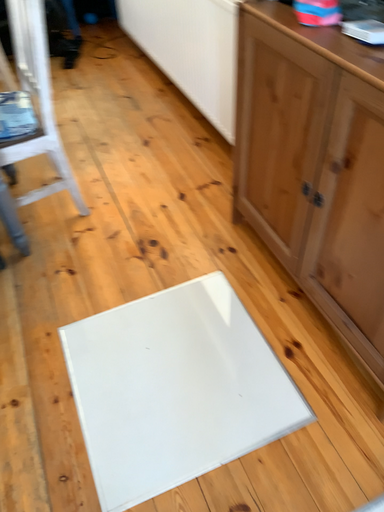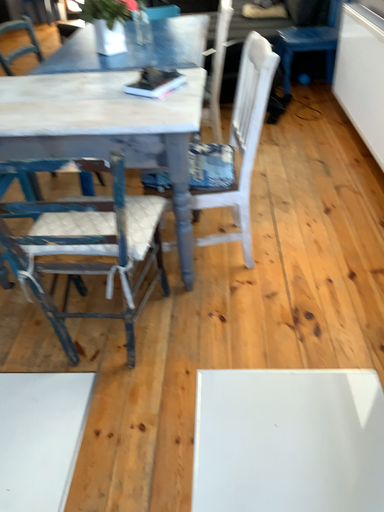
Question: How did the camera likely rotate when shooting the video?

Choices:
 (A) rotated downward
 (B) rotated upward

Answer: (B)